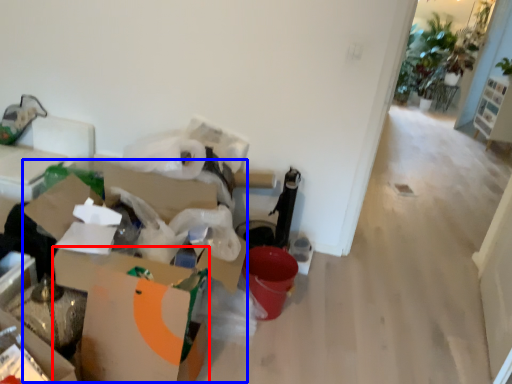
Question: Among these objects, which one is farthest to the camera, cardboard box (highlighted by a red box) or cardboard box (highlighted by a blue box)?

Choices:
 (A) cardboard box
 (B) cardboard box

Answer: (B)